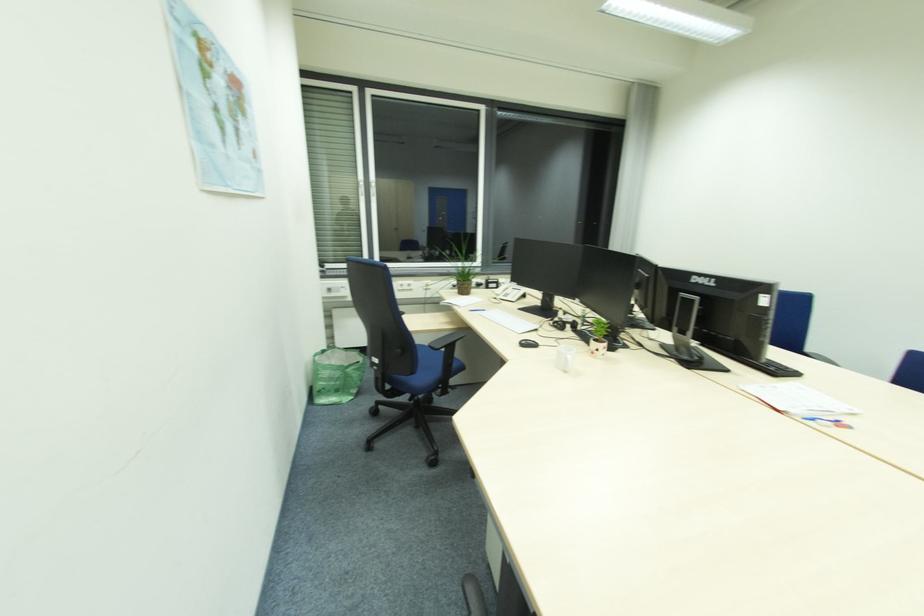
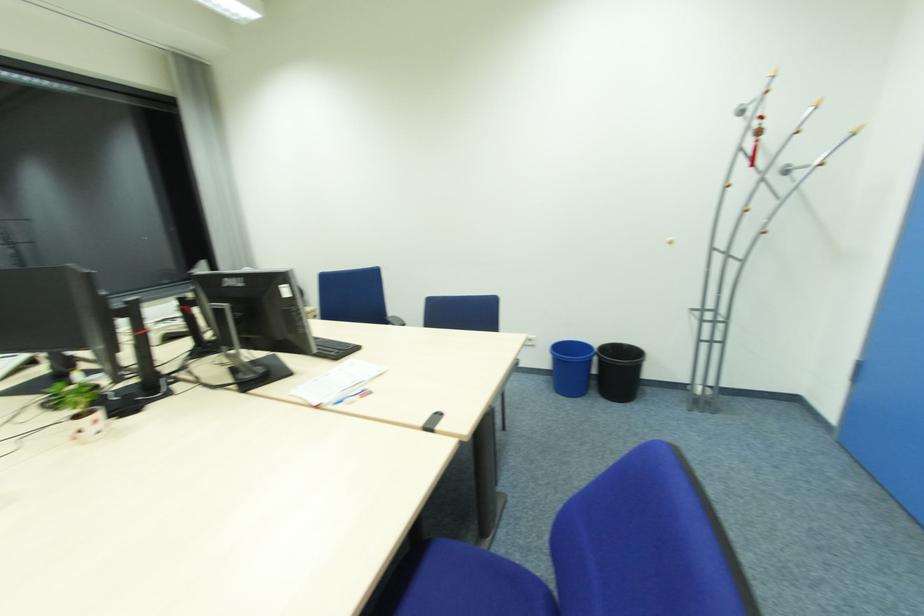
Question: The camera is either moving clockwise (left) or counter-clockwise (right) around the object. The first image is from the beginning of the video and the second image is from the end. Is the camera moving left or right when shooting the video?

Choices:
 (A) Left
 (B) Right

Answer: (A)